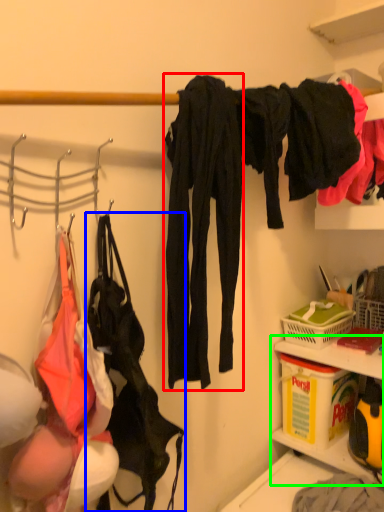
Question: Based on their relative distances, which object is nearer to clothing (highlighted by a red box)? Choose from handbag (highlighted by a blue box) and cabinet (highlighted by a green box).

Choices:
 (A) handbag
 (B) cabinet

Answer: (A)